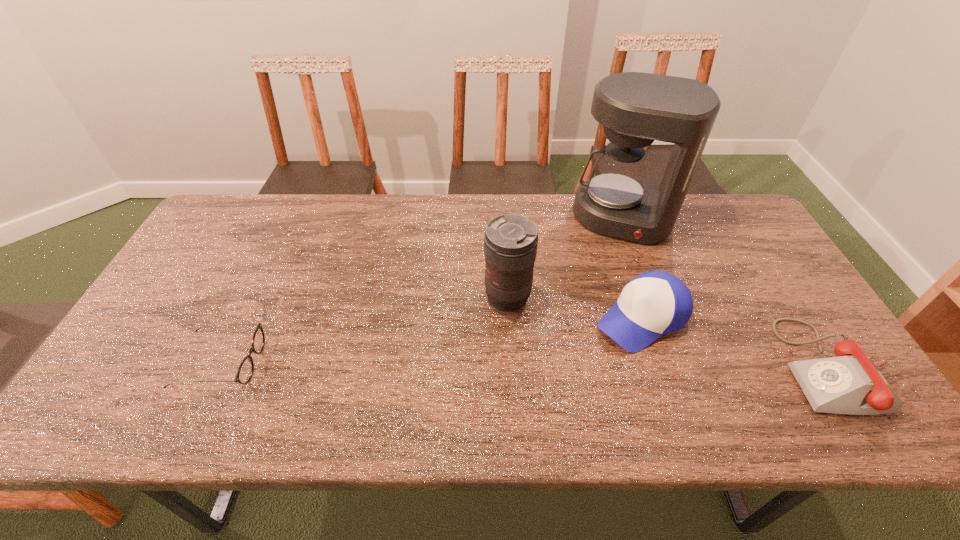
Find the location of a particular element. blank region between the baseball cap and the telephone is located at coordinates 738,342.

Locate an element on the screen. This screenshot has width=960, height=540. vacant space in between the farthest object and the telephone is located at coordinates (729, 293).

Where is `free space that is in between the telephone and the farthest object`? The height and width of the screenshot is (540, 960). free space that is in between the telephone and the farthest object is located at coordinates (729, 293).

You are a GUI agent. You are given a task and a screenshot of the screen. Output one action in this format:
    pyautogui.click(x=<x>, y=<y>)
    Task: Click on the empty location between the third tallest object and the spectacles
    The width and height of the screenshot is (960, 540).
    Given the screenshot: What is the action you would take?
    coord(431,340)

Identify which object is the second nearest to the telephoto lens. Please provide its 2D coordinates. Your answer should be formatted as a tuple, i.e. [(x, y)], where the tuple contains the x and y coordinates of a point satisfying the conditions above.

[(635, 108)]

Select which object is the second closest to the baseball cap. Please provide its 2D coordinates. Your answer should be formatted as a tuple, i.e. [(x, y)], where the tuple contains the x and y coordinates of a point satisfying the conditions above.

[(635, 108)]

Identify the location of vacant region that satisfies the following two spatial constraints: 1. on the front side of the second shortest object; 2. on the dial of the baseball cap. The width and height of the screenshot is (960, 540). (658, 367).

Find the location of a particular element. The height and width of the screenshot is (540, 960). free space that satisfies the following two spatial constraints: 1. on the front side of the rightmost object; 2. on the dial of the baseball cap is located at coordinates (658, 367).